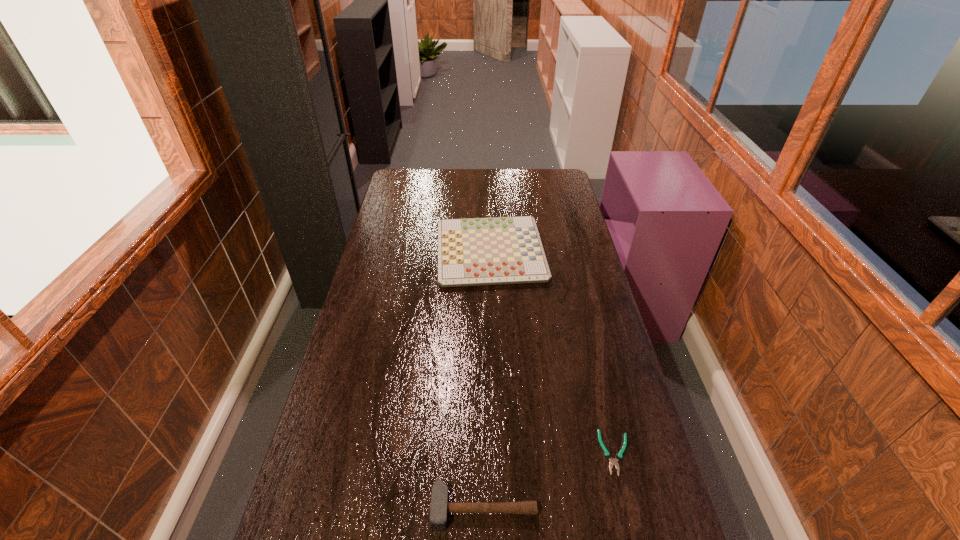
You are a GUI agent. You are given a task and a screenshot of the screen. Output one action in this format:
    pyautogui.click(x=<x>, y=<y>)
    Task: Click on the vacant area between the nearest object and the second nearest object
    The image size is (960, 540).
    Given the screenshot: What is the action you would take?
    pyautogui.click(x=549, y=480)

The image size is (960, 540). Find the location of `empty space that is in between the gameboard and the shortest object`. empty space that is in between the gameboard and the shortest object is located at coordinates (553, 353).

What are the coordinates of `unoccupied position between the farthest object and the hammer` in the screenshot? It's located at (487, 380).

Where is `vacant space that's between the farthest object and the hammer`? vacant space that's between the farthest object and the hammer is located at coordinates (487, 380).

You are a GUI agent. You are given a task and a screenshot of the screen. Output one action in this format:
    pyautogui.click(x=<x>, y=<y>)
    Task: Click on the vacant space that's between the hammer and the farthest object
    
    Given the screenshot: What is the action you would take?
    pyautogui.click(x=487, y=380)

The width and height of the screenshot is (960, 540). I want to click on vacant area that lies between the pliers and the gameboard, so click(x=553, y=353).

Where is `vacant point located between the nearest object and the farthest object`? This screenshot has width=960, height=540. vacant point located between the nearest object and the farthest object is located at coordinates (487, 380).

This screenshot has width=960, height=540. Identify the location of free space that is in between the second nearest object and the farthest object. (553, 353).

You are a GUI agent. You are given a task and a screenshot of the screen. Output one action in this format:
    pyautogui.click(x=<x>, y=<y>)
    Task: Click on the blank region between the hammer and the gameboard
    Image resolution: width=960 pixels, height=540 pixels.
    Given the screenshot: What is the action you would take?
    pyautogui.click(x=487, y=380)

At what (x,y) coordinates should I click in order to perform the action: click on free area in between the gameboard and the nearest object. Please return your answer as a coordinate pair (x, y). This screenshot has width=960, height=540. Looking at the image, I should click on (487, 380).